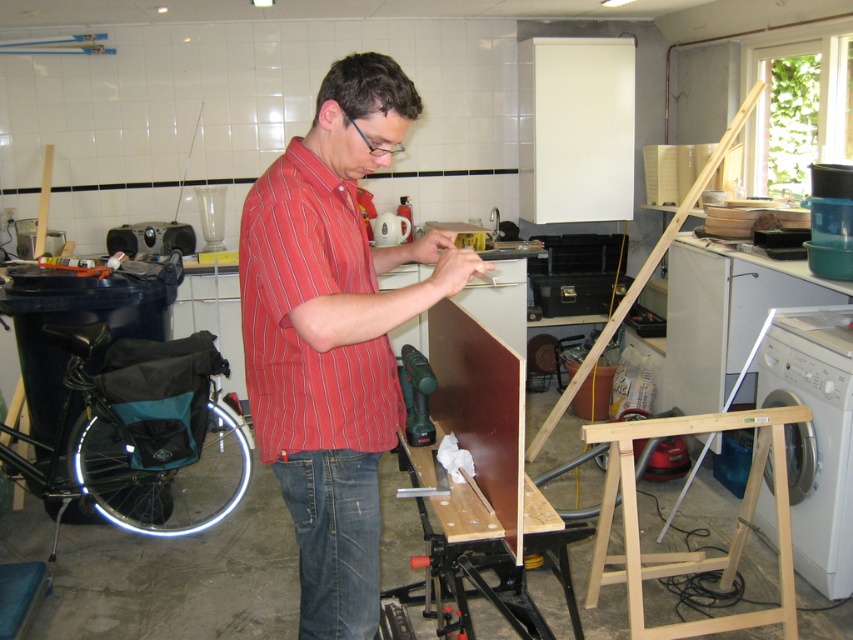
You are a safety inspector checking the workshop. You notice the red striped shirt at center and the green plastic drill at center. According to safety protocols, the drill should not be placed where the shirt is. Is the drill currently positioned in a compliant location?

The red striped shirt at center is in front of the green plastic drill at center, meaning the drill is behind the shirt. Since the drill is not in front of the shirt, it is positioned in a compliant location according to safety protocols.

You are a person trying to reach the green plastic drill at center while standing on the denim jeans at lower center. Can you easily access the drill without bending down?

The denim jeans at lower center are taller than the green plastic drill at center, so you would need to bend down to reach the drill since it is lower in height.